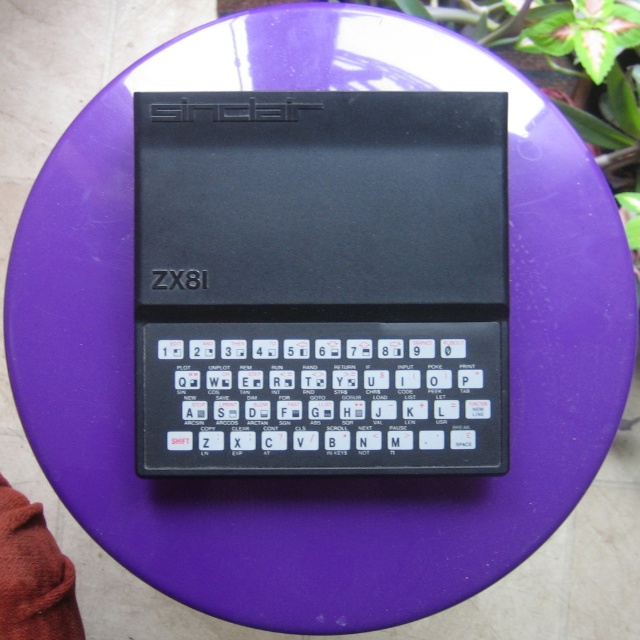
Looking at this image, you are setting up a display for a retro computing exhibit and need to place a label next to the black plastic Sinclair ZX81 at center and the black plastic keyboard at center. The label must be placed on the purple circular surface. Given that the Sinclair ZX81 is larger than the keyboard, where should you position the label so it doesn

The black plastic Sinclair ZX81 at center is bigger than the black plastic keyboard at center. Since the Sinclair ZX81 is larger, you should place the label next to the black plastic Sinclair ZX81 at center to ensure it is clearly visible and not obscured by the smaller keyboard.

You are setting up a display for a retro computing exhibition. The Sinclair ZX81 must be placed on a circular purple surface. You have a black plastic Sinclair ZX81 at center and a black plastic keyboard at center. Which object should you ensure is positioned first to avoid overcrowding the space?

The black plastic Sinclair ZX81 at center might be wider than the black plastic keyboard at center, so you should position the Sinclair ZX81 first to ensure there is enough space for both on the circular purple surface.